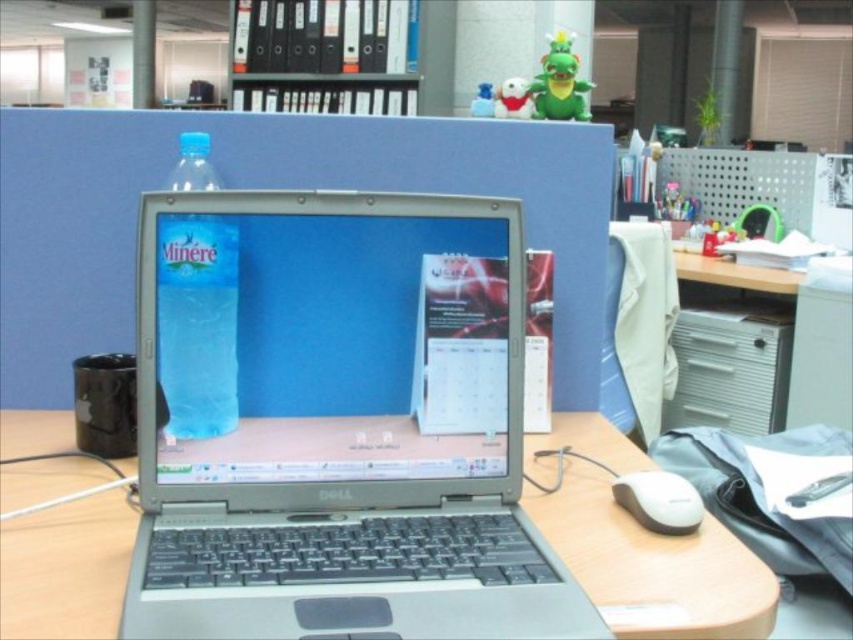
You are a person with a 4.5 cm wide hand. You want to move your hand from the wooden desk at center to the white matte mouse at lower right. Can your hand fit in the space between them?

The wooden desk at center and white matte mouse at lower right are 5.22 centimeters apart, so yes, your hand can fit in the space between them since it is wider than your hand.

You are setting up a new monitor that requires a stand 20 cm tall. Can the wooden desk at center support the stand without it touching the white matte mouse at lower right?

The wooden desk at center has a greater height compared to white matte mouse at lower right. Since the desk is taller, the stand can be placed on it without touching the mouse as long as there is enough space between them.

You are standing at the point labeled as point (183, 241) and want to reach the Dell laptop on the desk. Considering the distance between you and the laptop is 27.27 inches, can you comfortably reach it without moving your position?

The distance between point (183, 241) and the Dell laptop is 27.27 inches. A typical comfortable reaching distance for most adults is around 22 to 26 inches. Therefore, reaching 27.27 inches might be slightly uncomfortable unless you lean forward. Consider adjusting your position for better comfort.